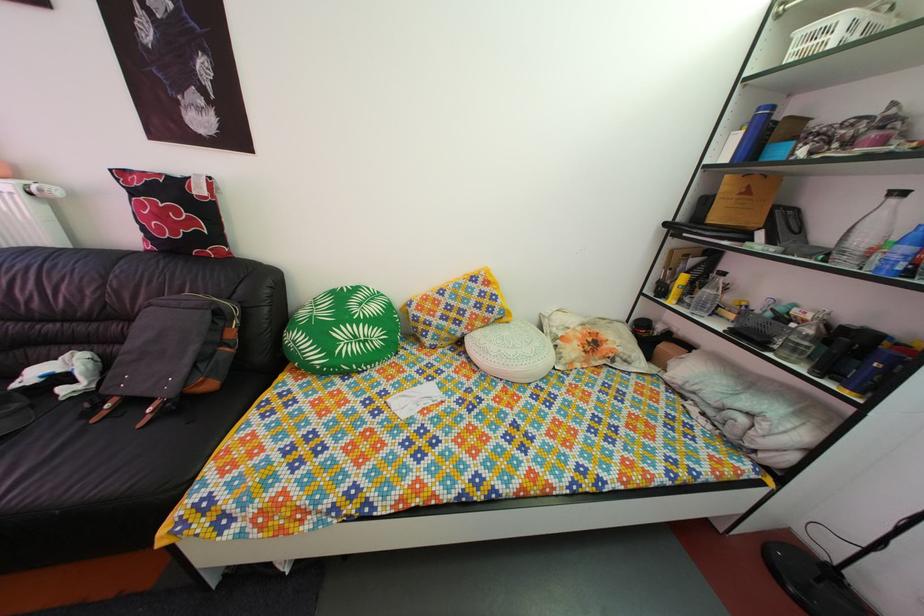
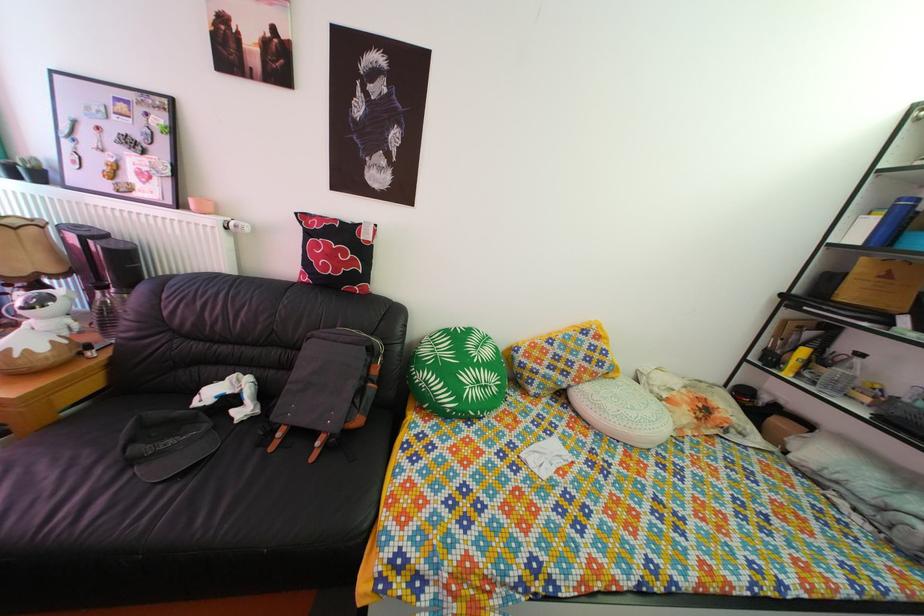
Where in the second image is the point corresponding to pixel 54 195 from the first image?

(249, 232)